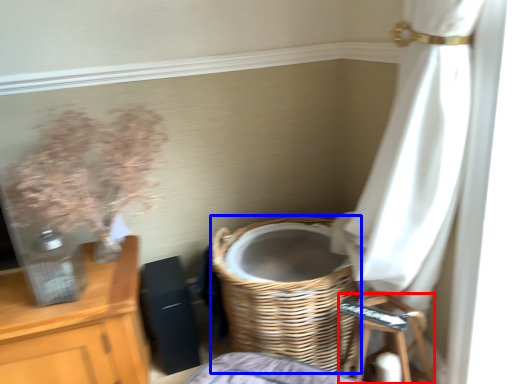
Question: Which object is closer to the camera taking this photo, step stool (highlighted by a red box) or basket (highlighted by a blue box)?

Choices:
 (A) step stool
 (B) basket

Answer: (A)